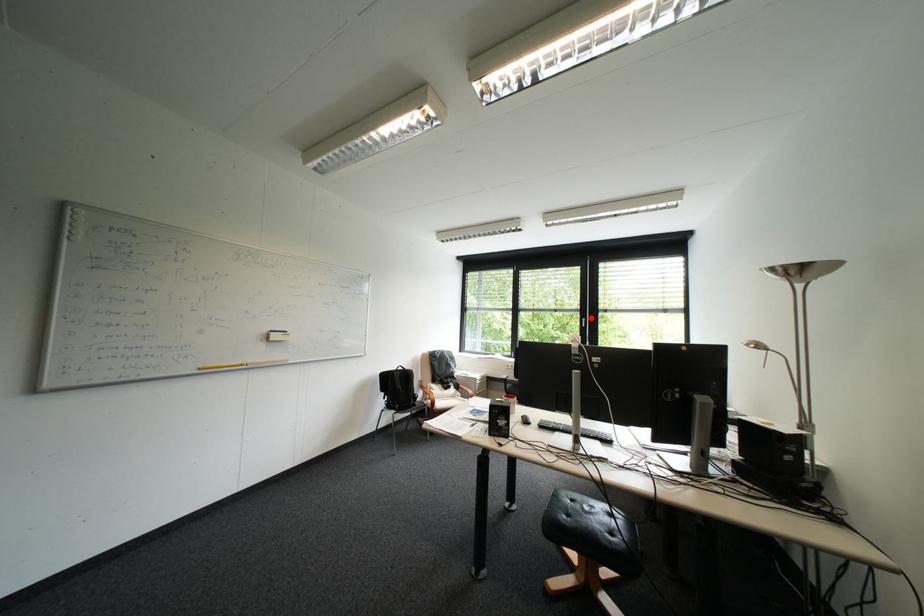
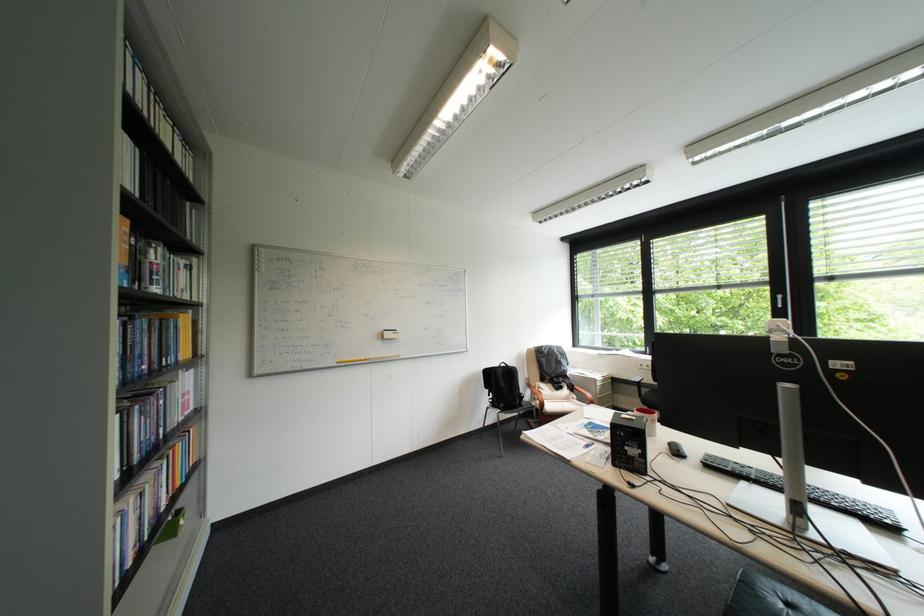
Find the pixel in the second image that matches the highlighted location in the first image.

(781, 294)